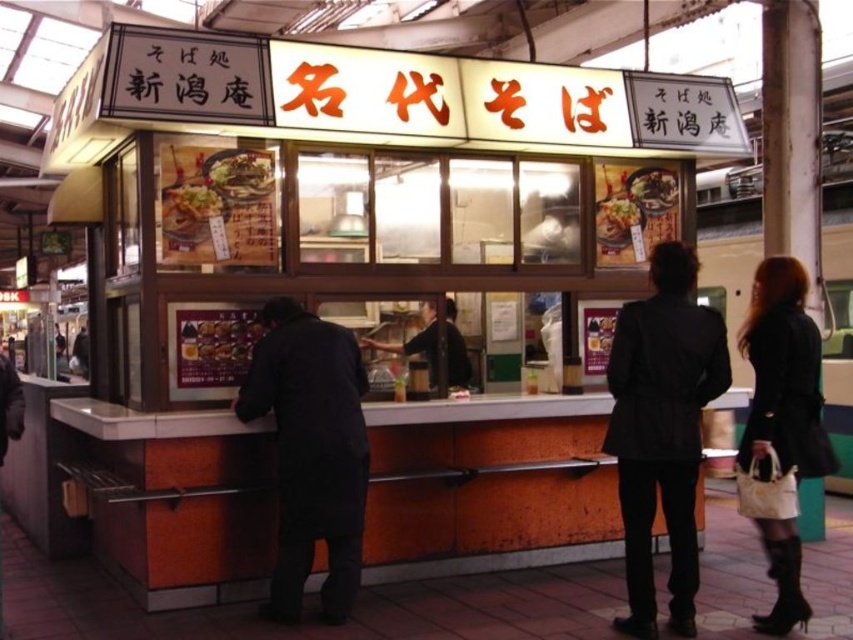
Question: Does black matte jacket at center have a lesser width compared to shiny brown bowl at center?

Choices:
 (A) yes
 (B) no

Answer: (B)

Question: Is shiny brown bowl at center further to camera compared to shiny plastic bowl at center?

Choices:
 (A) yes
 (B) no

Answer: (B)

Question: Which is nearer to the shiny brown bowl at center?

Choices:
 (A) shiny silver bowl at upper center
 (B) shiny plastic food at center

Answer: (B)

Question: Estimate the real-world distances between objects in this image. Which object is farther from the dark gray uniform at center?

Choices:
 (A) black leather coat at right
 (B) shiny silver bowl at upper center
 (C) black matte jacket at center
 (D) black matte coat at center

Answer: (A)

Question: Does black matte jacket at center appear over shiny brown bowl at center?

Choices:
 (A) no
 (B) yes

Answer: (A)

Question: Which of the following is the farthest from the observer?

Choices:
 (A) (263, 412)
 (B) (618, 211)
 (C) (677, 552)

Answer: (B)